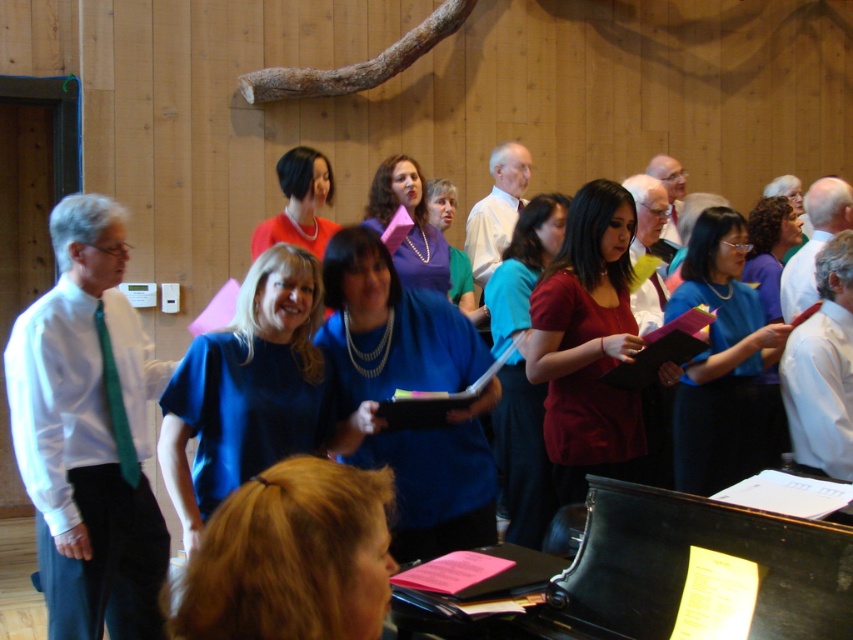
You are a photographer setting up for a group photo in the room. You notice the blonde hair at center and the matte blue dress at center. Which object should you focus on to ensure both are in frame without cropping? Explain your reasoning.

The blonde hair at center occupies less space than the matte blue dress at center. Therefore, focusing on the matte blue dress at center ensures both will fit in the frame since it takes up more space and can help anchor the composition.

You are a photographer standing at the back of the room. You want to take a photo of the blue fabric shirt at center and the matte blue blouse at center. Which one will appear larger in your photo?

The blue fabric shirt at center will appear larger in the photo because it is closer to the viewer than the matte blue blouse at center.